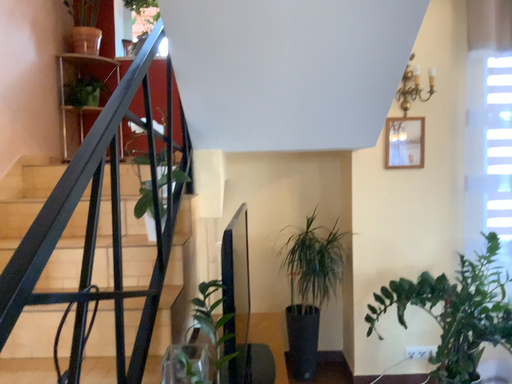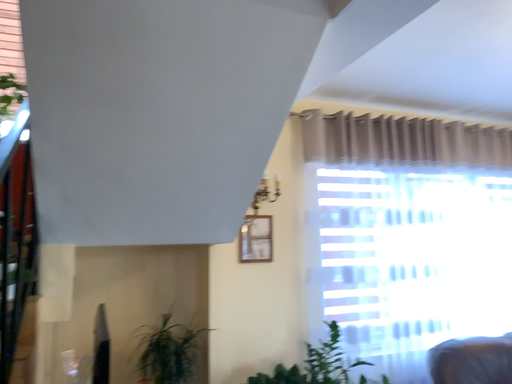
Question: How did the camera likely rotate when shooting the video?

Choices:
 (A) rotated downward
 (B) rotated upward

Answer: (B)